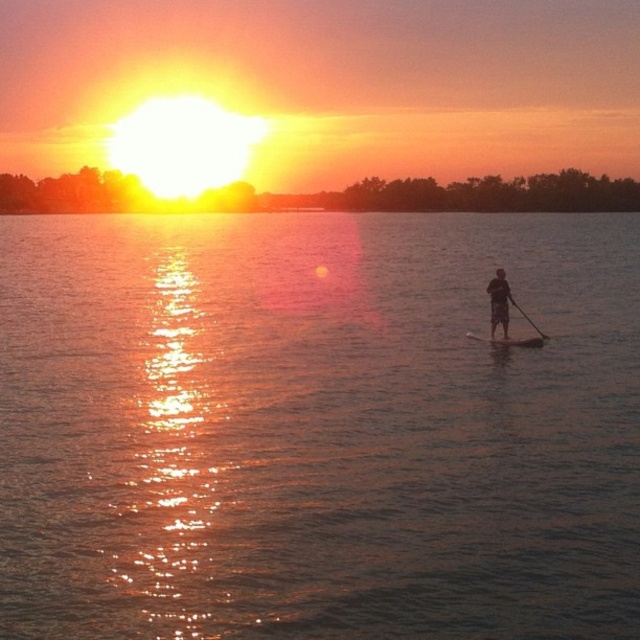
You are a photographer trying to capture the sunset reflection on the water. You have a smooth wooden paddleboard at right and a black smooth paddle at right. Which object should you place closer to the camera to ensure it doesn t block the sunset reflection?

The smooth wooden paddleboard at right has a smaller size compared to the black smooth paddle at right. Therefore, placing the smaller smooth wooden paddleboard at right closer to the camera would be better as it won t block the sunset reflection as much as the larger paddle.

You are a water sports enthusiast planning to use both the smooth wooden paddleboard at right and the black smooth paddle at right for a sunset paddleboarding session. Considering their widths, which object would provide more stability and why?

The smooth wooden paddleboard at right is wider than the black smooth paddle at right, so it provides more stability because wider boards generally distribute your weight over a larger area, making them more stable.

You are an artist trying to paint the sunset scene. You have a canvas that can only fit objects up to the size of the black smooth paddle at right. Can you fit the glistening water at center on your canvas?

The glistening water at center has a larger width than the black smooth paddle at right, so it cannot fit on the canvas designed for the paddle.